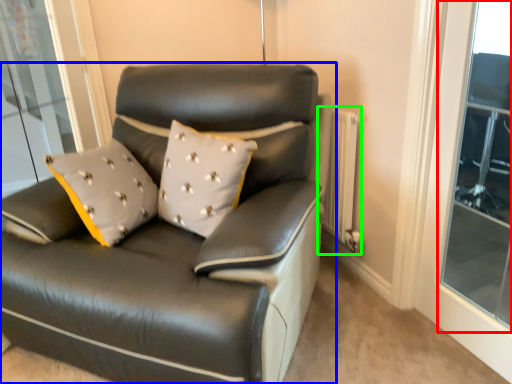
Question: Which object is positioned closest to window (highlighted by a red box)? Select from studio couch (highlighted by a blue box) and radiator (highlighted by a green box).

Choices:
 (A) studio couch
 (B) radiator

Answer: (B)